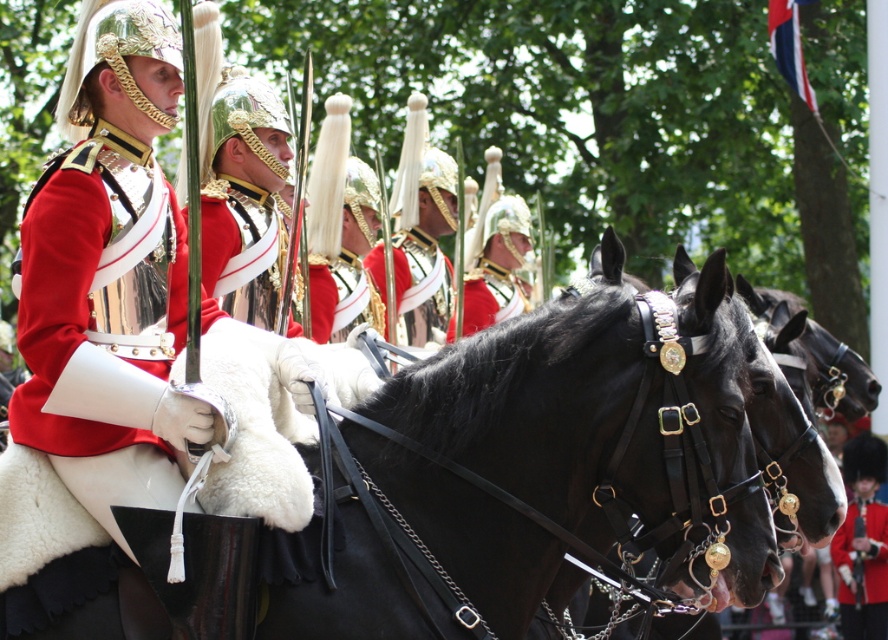
Measure the distance between black leather horse at center and camera.

black leather horse at center is 11.65 meters from camera.

Which is more to the right, black leather horse at center or shiny red fabric at center?

From the viewer's perspective, black leather horse at center appears more on the right side.

Is point (323, 593) positioned behind point (226, 192)?

No, (323, 593) is closer to viewer.

I want to click on black leather horse at center, so click(536, 465).

Is point (226, 259) closer to viewer compared to point (464, 292)?

Yes.

Can you confirm if shiny red fabric at center is taller than shiny gold helmet at center?

Correct, shiny red fabric at center is much taller as shiny gold helmet at center.

Is point (232, 310) positioned after point (511, 307)?

No, (232, 310) is in front of (511, 307).

Identify the location of shiny red fabric at center. This screenshot has width=888, height=640. (240, 250).

Which of these two, shiny red fabric at center or metallic silver helmet at center, stands shorter?

shiny red fabric at center

Which is more to the left, shiny red fabric at center or metallic silver helmet at center?

Positioned to the left is shiny red fabric at center.

I want to click on shiny red fabric at center, so click(x=240, y=250).